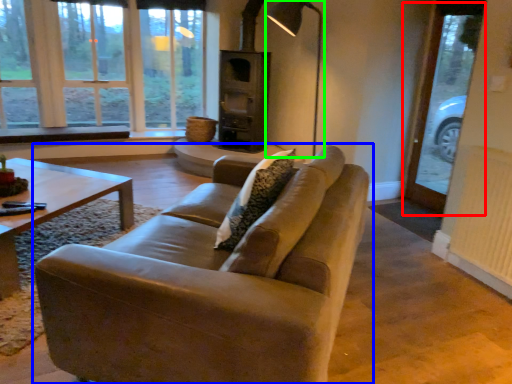
Question: Which object is the closest to the screen door (highlighted by a red box)? Choose among these: studio couch (highlighted by a blue box) or lamp (highlighted by a green box).

Choices:
 (A) studio couch
 (B) lamp

Answer: (B)